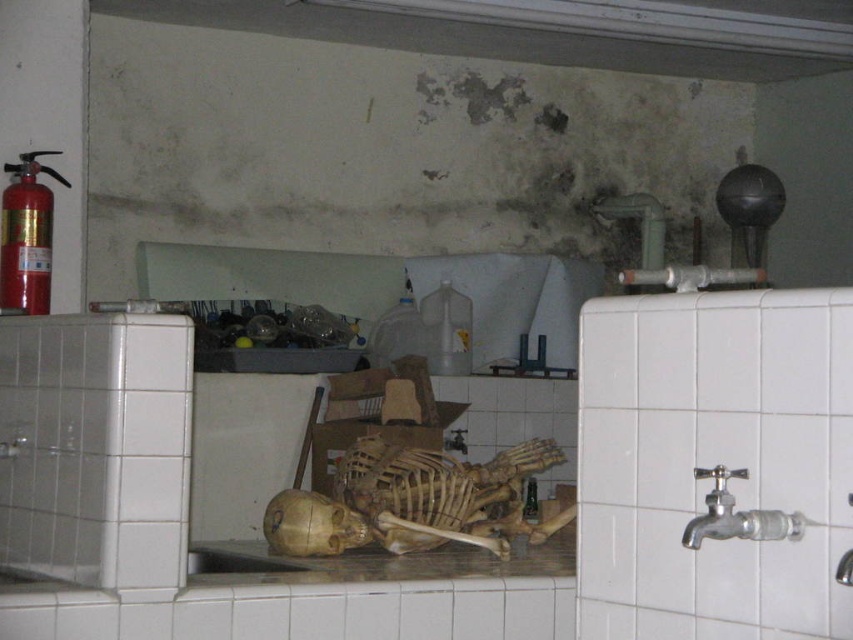
Question: Among these objects, which one is farthest from the camera?

Choices:
 (A) silver metallic faucet at right
 (B) wooden skeleton at center
 (C) brown wooden skeleton at center

Answer: (C)

Question: Among these objects, which one is nearest to the camera?

Choices:
 (A) wooden skeleton at center
 (B) brown wooden skeleton at center

Answer: (A)

Question: Which of the following is the farthest from the observer?

Choices:
 (A) (693, 474)
 (B) (351, 470)
 (C) (567, 564)

Answer: (B)

Question: Does wooden skeleton at center have a smaller size compared to silver metallic faucet at right?

Choices:
 (A) no
 (B) yes

Answer: (A)

Question: Can you confirm if brown wooden skeleton at center is positioned above wooden skeleton at center?

Choices:
 (A) no
 (B) yes

Answer: (B)

Question: Is wooden skeleton at center to the left of silver metallic faucet at right from the viewer's perspective?

Choices:
 (A) no
 (B) yes

Answer: (B)